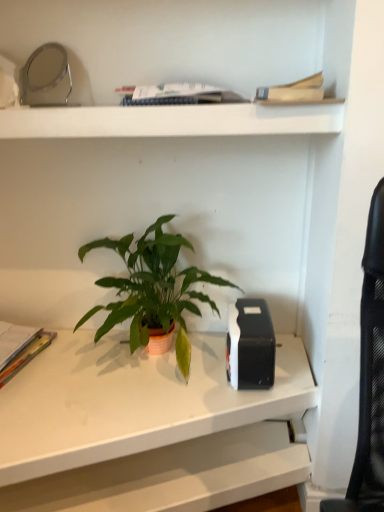
Question: In which direction should I rotate to look at hardcover book at upper center, the 1th paperback book viewed from the top?

Choices:
 (A) right
 (B) left

Answer: (A)

Question: Are white matte desk at center and white matte shelf at upper center making contact?

Choices:
 (A) yes
 (B) no

Answer: (B)

Question: Is white matte desk at center not within white matte shelf at upper center?

Choices:
 (A) no
 (B) yes

Answer: (B)

Question: Considering the relative sizes of white matte desk at center and white matte shelf at upper center in the image provided, is white matte desk at center bigger than white matte shelf at upper center?

Choices:
 (A) no
 (B) yes

Answer: (B)

Question: Can you confirm if white matte desk at center is smaller than white matte shelf at upper center?

Choices:
 (A) yes
 (B) no

Answer: (B)

Question: From the image's perspective, is white matte desk at center on top of white matte shelf at upper center?

Choices:
 (A) yes
 (B) no

Answer: (B)

Question: From the image's perspective, would you say white matte desk at center is shown under white matte shelf at upper center?

Choices:
 (A) no
 (B) yes

Answer: (B)

Question: Is white matte desk at center facing away from hardcover book at upper center, acting as the second paperback book starting from the back?

Choices:
 (A) yes
 (B) no

Answer: (B)

Question: Is the position of white matte desk at center less distant than that of hardcover book at upper center, the second paperback book in the bottom-to-top sequence?

Choices:
 (A) yes
 (B) no

Answer: (A)

Question: Could you tell me if white matte desk at center is turned towards hardcover book at upper center, acting as the second paperback book starting from the back?

Choices:
 (A) no
 (B) yes

Answer: (A)

Question: From the image's perspective, is white matte desk at center below hardcover book at upper center, the second paperback book in the bottom-to-top sequence?

Choices:
 (A) yes
 (B) no

Answer: (A)

Question: From the image's perspective, is white matte desk at center located above hardcover book at upper center, which is the first paperback book from front to back?

Choices:
 (A) yes
 (B) no

Answer: (B)

Question: From a real-world perspective, is white matte desk at center located beneath hardcover book at upper center, which is the first paperback book from front to back?

Choices:
 (A) no
 (B) yes

Answer: (B)

Question: Can you confirm if hardcover book at upper center, which ranks as the first paperback book in right-to-left order, is thinner than green matte houseplant at center?

Choices:
 (A) no
 (B) yes

Answer: (B)